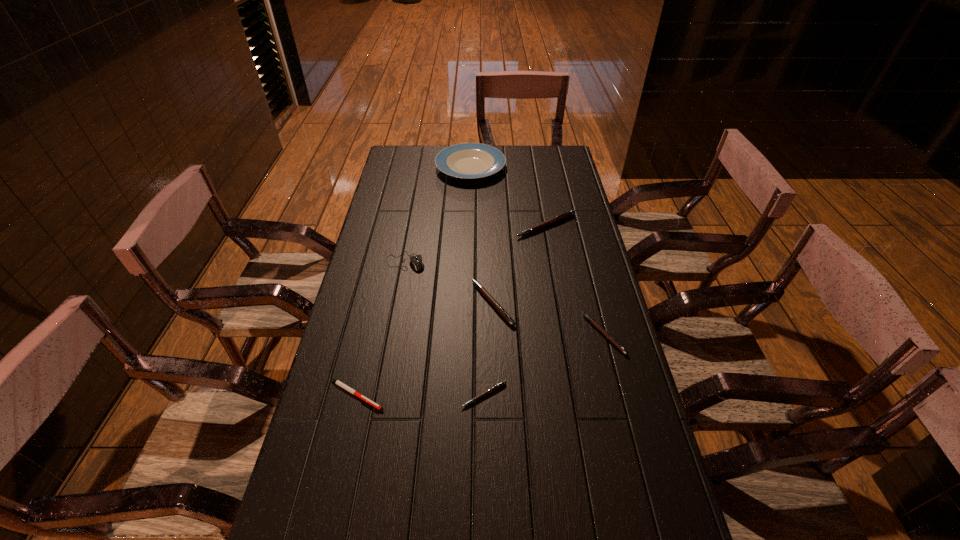
I want to click on white pen, so click(337, 382).

Find the location of `vacant area located on the right of the plate`. vacant area located on the right of the plate is located at coordinates (558, 167).

Locate an element on the screen. vacant area situated 0.160m on the back of the computer mouse is located at coordinates (413, 224).

Where is `free space located 0.190m at the nib of the second farthest object`? The image size is (960, 540). free space located 0.190m at the nib of the second farthest object is located at coordinates (555, 276).

This screenshot has height=540, width=960. What are the coordinates of `free space located 0.260m at the nib of the second biggest pink pen` in the screenshot? It's located at (386, 303).

Locate an element on the screen. This screenshot has height=540, width=960. vacant position located 0.070m at the nib of the second biggest pink pen is located at coordinates (448, 303).

Locate an element on the screen. This screenshot has height=540, width=960. free location located 0.360m at the nib of the second biggest pink pen is located at coordinates (353, 303).

Where is `vacant region located at the nib of the third biggest pink pen`? This screenshot has height=540, width=960. vacant region located at the nib of the third biggest pink pen is located at coordinates (488, 334).

Where is `free spot located 0.110m at the nib of the third biggest pink pen`? Image resolution: width=960 pixels, height=540 pixels. free spot located 0.110m at the nib of the third biggest pink pen is located at coordinates (547, 334).

Identify the location of blank area located at the nib of the third biggest pink pen. This screenshot has height=540, width=960. (492, 334).